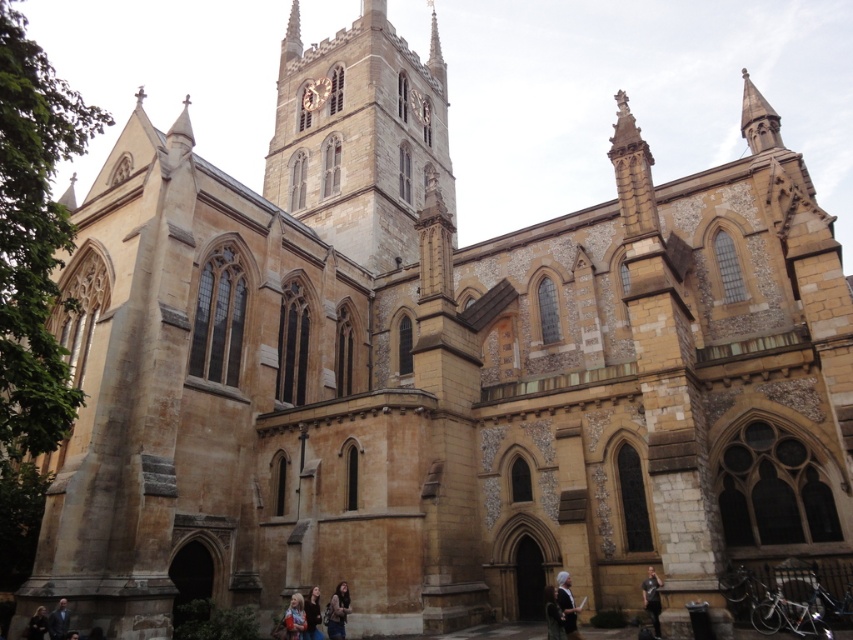
You are standing in front of the cathedral and notice both the golden stone tower at center and the dark brown leather jacket at lower left. Which object appears larger in size?

The golden stone tower at center appears larger than the dark brown leather jacket at lower left.

You are standing in front of the cathedral and notice a dark blue fabric headscarf at lower right and a dark brown leather jacket at lower right. You want to pick up the headscarf but need to know if it is closer to you than the jacket. Can you determine this?

The dark blue fabric headscarf at lower right is 3.31 feet away from dark brown leather jacket at lower right, so the distance between them is 3.31 feet. However, without knowing your exact position relative to both items, it is impossible to determine which one is closer to you.